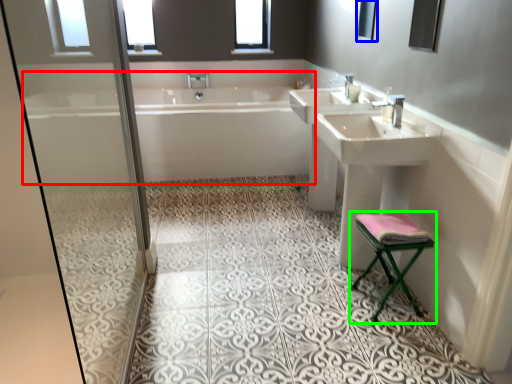
Question: Which object is the farthest from bathtub (highlighted by a red box)? Choose among these: mirror (highlighted by a blue box) or furniture (highlighted by a green box).

Choices:
 (A) mirror
 (B) furniture

Answer: (B)